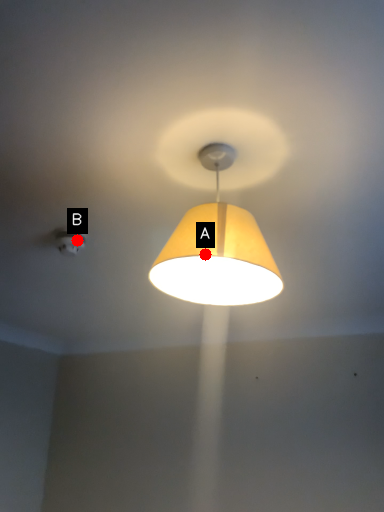
Question: Two points are circled on the image, labeled by A and B beside each circle. Which of the following is the farthest from the observer?

Choices:
 (A) A is further
 (B) B is further

Answer: (B)